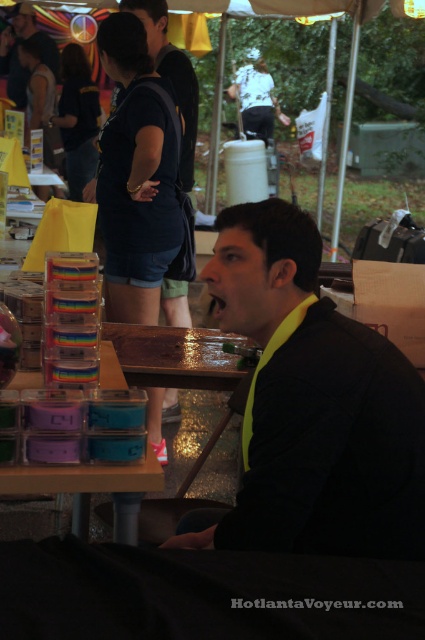
Who is taller, black matte jacket at center or matte plastic containers at lower center?

Standing taller between the two is black matte jacket at center.

Is black matte jacket at center to the left of matte plastic containers at lower center from the viewer's perspective?

Incorrect, black matte jacket at center is not on the left side of matte plastic containers at lower center.

Which is in front, point (252, 413) or point (78, 499)?

Point (252, 413) is more forward.

Locate an element on the screen. black matte jacket at center is located at coordinates (311, 406).